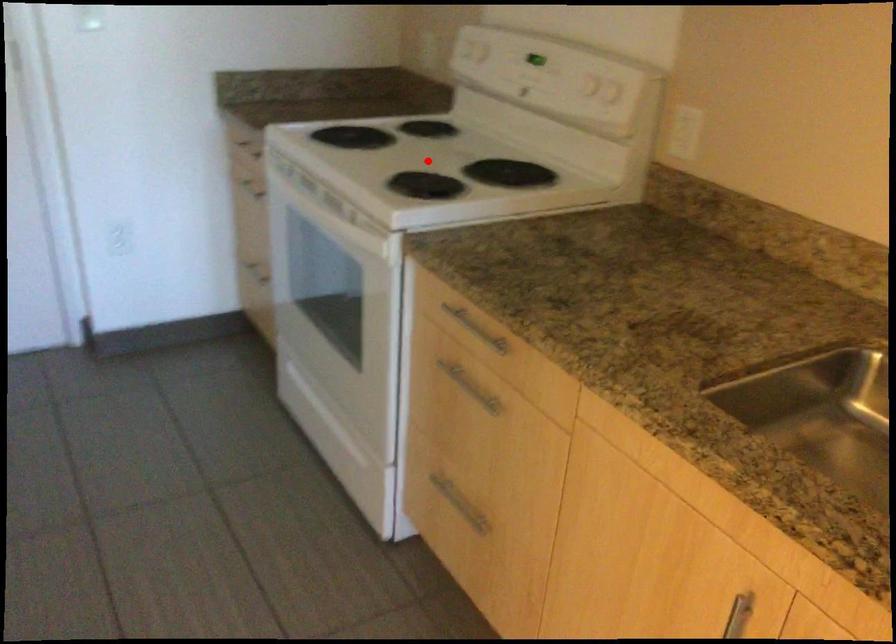
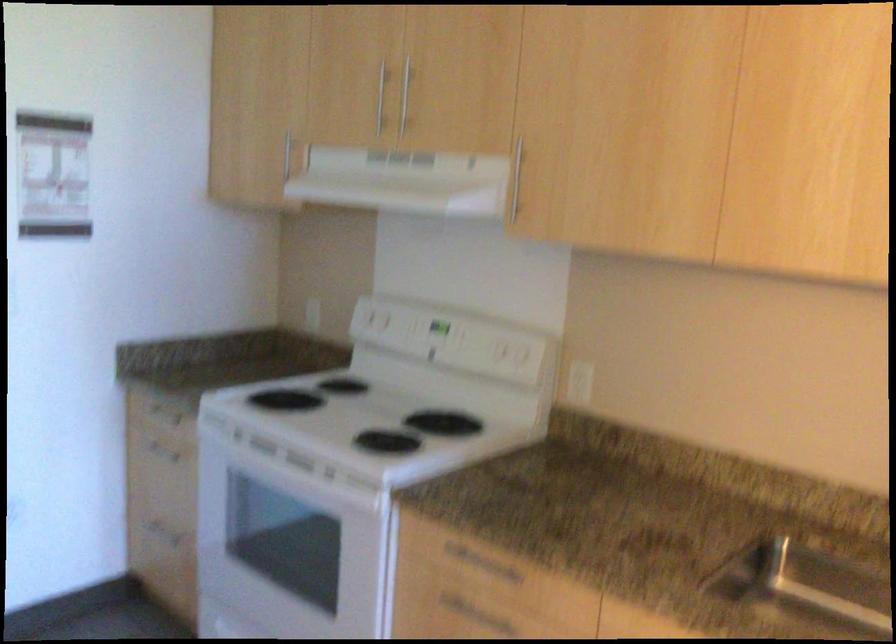
In the second image, find the point that corresponds to the highlighted location in the first image.

(367, 415)